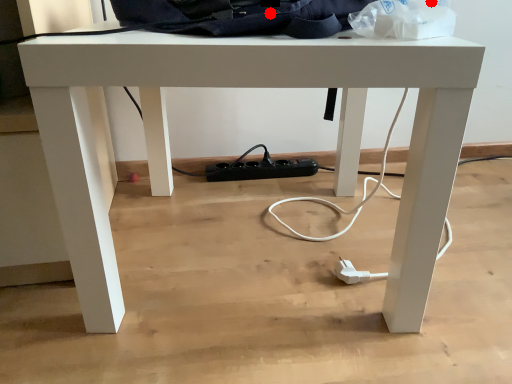
Question: Two points are circled on the image, labeled by A and B beside each circle. Which point is farther from the camera taking this photo?

Choices:
 (A) A is further
 (B) B is further

Answer: (A)